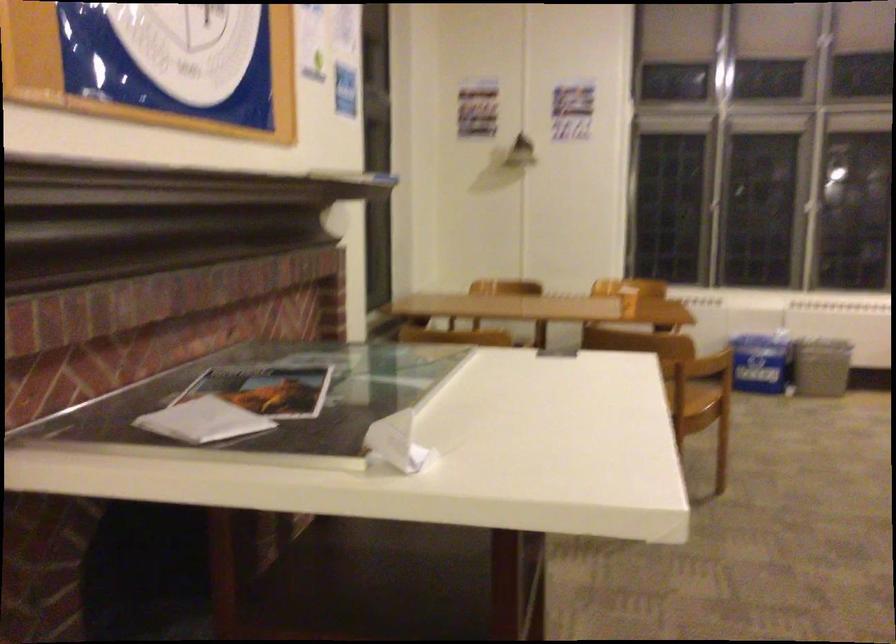
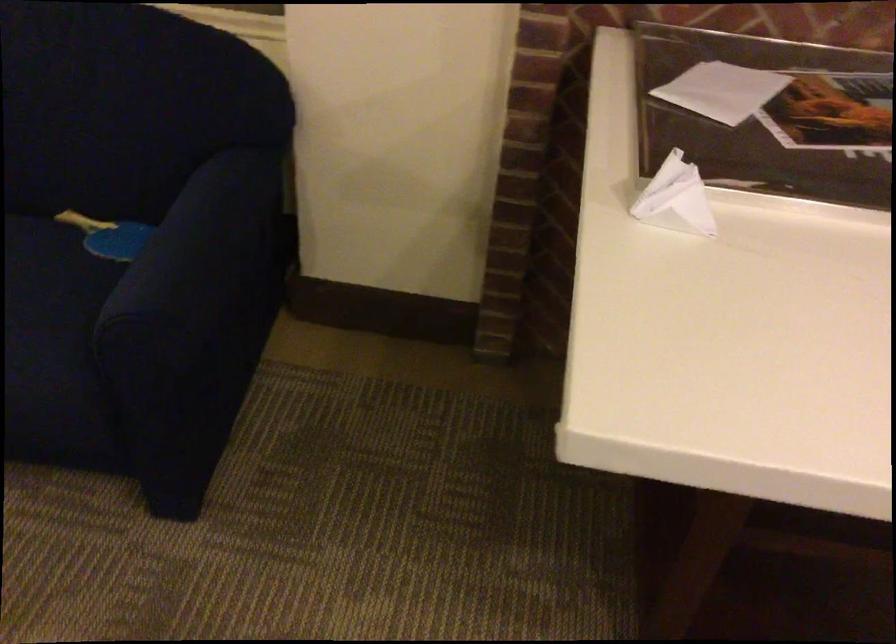
In the second image, find the point that corresponds to (x=271, y=415) in the first image.

(771, 117)